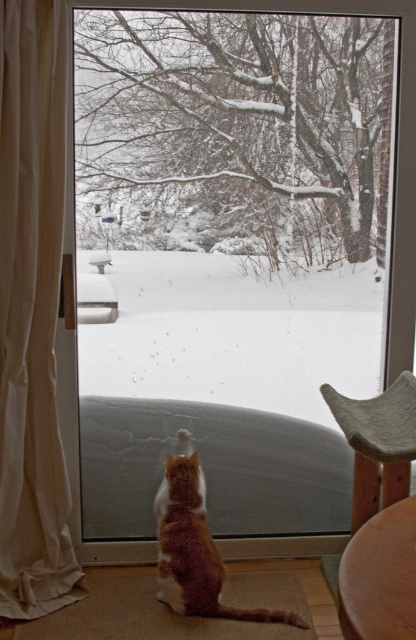
You are standing in a room looking through a large glass door. You see a white fabric curtain at left and an orange fur cat at center. Which object is closer to the left side of the room?

The white fabric curtain at left is closer to the left side of the room because it is positioned to the left of the orange fur cat at center.